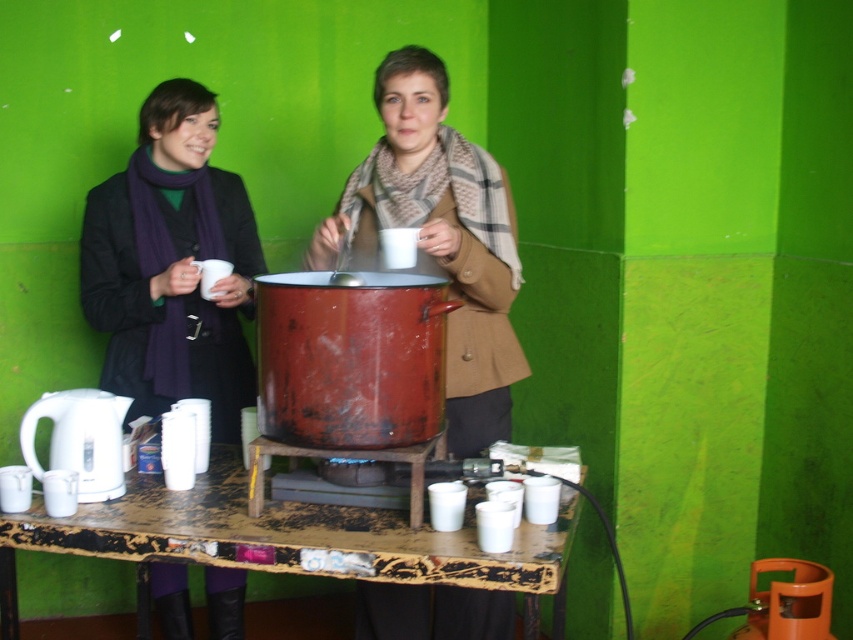
Is point (213, 129) positioned after point (65, 390)?

Yes.

This screenshot has width=853, height=640. Describe the element at coordinates (172, 266) in the screenshot. I see `purple scarf at left` at that location.

At what (x,y) coordinates should I click in order to perform the action: click on purple scarf at left. Please return your answer as a coordinate pair (x, y). This screenshot has height=640, width=853. Looking at the image, I should click on (172, 266).

How distant is wooden table at center from white plastic kettle at lower left?

They are 27.85 centimeters apart.

Where is `wooden table at center`? wooden table at center is located at coordinates (288, 540).

Is point (161, 122) closer to camera compared to point (405, 172)?

No, it is behind (405, 172).

Is purple scarf at left shorter than plaid scarf at center?

No, purple scarf at left is not shorter than plaid scarf at center.

Which is in front, point (247, 289) or point (392, 150)?

Point (392, 150) is more forward.

The width and height of the screenshot is (853, 640). I want to click on purple scarf at left, so click(x=172, y=266).